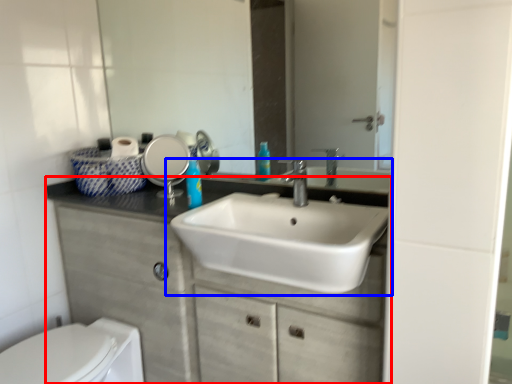
Question: Which object appears farthest to the camera in this image, bathroom cabinet (highlighted by a red box) or sink (highlighted by a blue box)?

Choices:
 (A) bathroom cabinet
 (B) sink

Answer: (A)